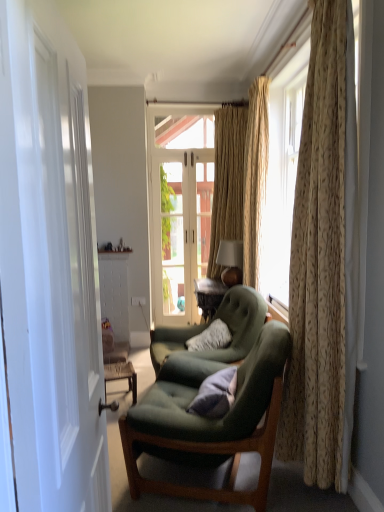
Question: In the image, is velvet green armchair at center, the first chair when ordered from back to front, positioned in front of or behind matte gold lampshade at upper right?

Choices:
 (A) behind
 (B) front

Answer: (B)

Question: From their relative heights in the image, would you say velvet green armchair at center, which is the 2th chair from front to back, is taller or shorter than matte gold lampshade at upper right?

Choices:
 (A) short
 (B) tall

Answer: (B)

Question: Which object is the closest to the green fabric chair at center, the second chair positioned from the back?

Choices:
 (A) floral beige curtain at right, arranged as the first curtain when viewed from the front
 (B) beige textured curtain at center, the 3th curtain viewed from the front
 (C) white glossy door at left
 (D) white plastic power outlet at center
 (E) velvet purple pillow at center

Answer: (E)

Question: Which is farther from the white glass door at center?

Choices:
 (A) beige textured curtain at center, the 3th curtain viewed from the front
 (B) floral beige curtain at right, arranged as the first curtain when viewed from the front
 (C) green fabric couch at center
 (D) white plastic power outlet at center
 (E) matte gold lampshade at upper right

Answer: (B)